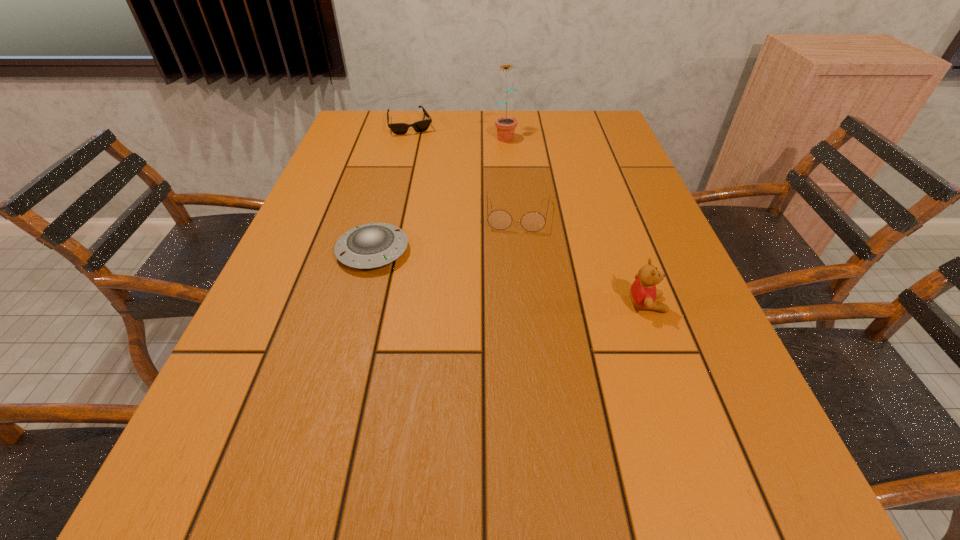
Identify the location of free location that satisfies the following two spatial constraints: 1. on the back side of the saucer; 2. on the left side of the sunglasses. This screenshot has width=960, height=540. tap(406, 125).

Where is `vacant space that satisfies the following two spatial constraints: 1. on the front side of the saucer; 2. on the front-facing side of the nearest object`? vacant space that satisfies the following two spatial constraints: 1. on the front side of the saucer; 2. on the front-facing side of the nearest object is located at coordinates (359, 304).

I want to click on free space that satisfies the following two spatial constraints: 1. on the front side of the sunglasses; 2. on the right side of the third shortest object, so click(388, 214).

You are a GUI agent. You are given a task and a screenshot of the screen. Output one action in this format:
    pyautogui.click(x=<x>, y=<y>)
    Task: Click on the vacant area that satisfies the following two spatial constraints: 1. on the back side of the saucer; 2. on the left side of the third tallest object
    
    Given the screenshot: What is the action you would take?
    pyautogui.click(x=383, y=214)